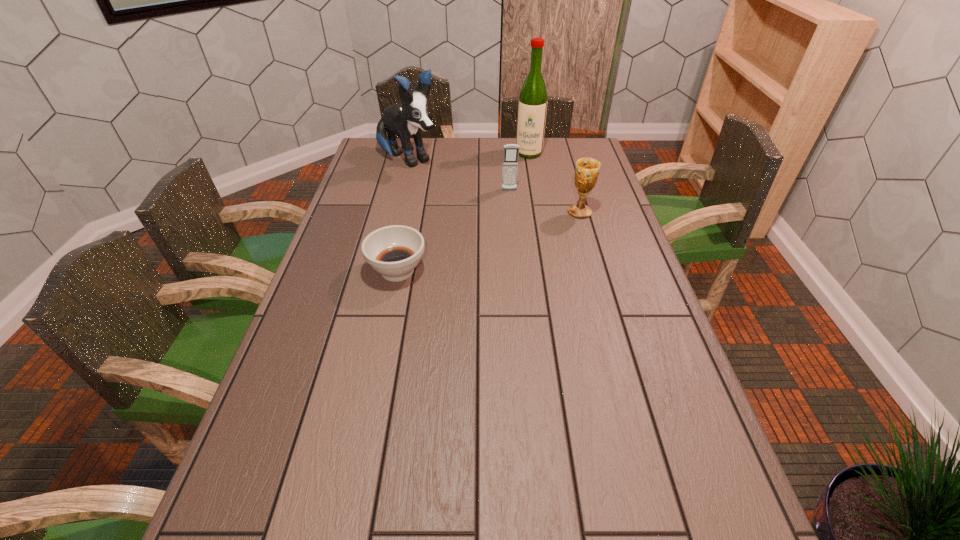
The height and width of the screenshot is (540, 960). I want to click on the shortest object, so click(x=394, y=251).

The image size is (960, 540). I want to click on the nearest object, so click(394, 251).

Where is `the rightmost object`? the rightmost object is located at coordinates (587, 169).

Where is `chalice`? chalice is located at coordinates (587, 169).

You are a GUI agent. You are given a task and a screenshot of the screen. Output one action in this format:
    pyautogui.click(x=<x>, y=<y>)
    Task: Click on the third object from left to right
    
    Given the screenshot: What is the action you would take?
    pyautogui.click(x=511, y=151)

This screenshot has height=540, width=960. I want to click on cellular telephone, so click(x=511, y=151).

Identify the location of the fourth object from left to right. (532, 106).

Find the location of a particular element. the fourth shortest object is located at coordinates (406, 119).

Where is `free space located on the front of the soup bowl`? The width and height of the screenshot is (960, 540). free space located on the front of the soup bowl is located at coordinates (386, 328).

This screenshot has width=960, height=540. What are the coordinates of `blank space located on the left of the chalice` in the screenshot? It's located at (454, 212).